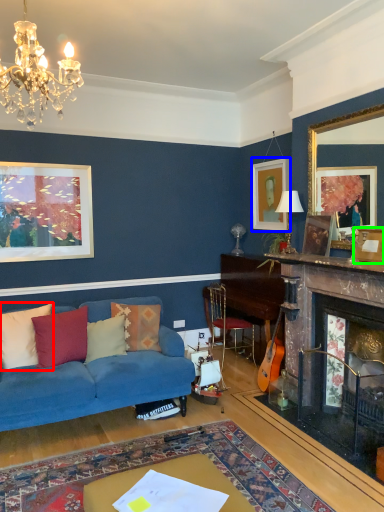
Question: Which object is positioned farthest from pillow (highlighted by a red box)? Select from picture frame (highlighted by a blue box) and picture frame (highlighted by a green box).

Choices:
 (A) picture frame
 (B) picture frame

Answer: (A)